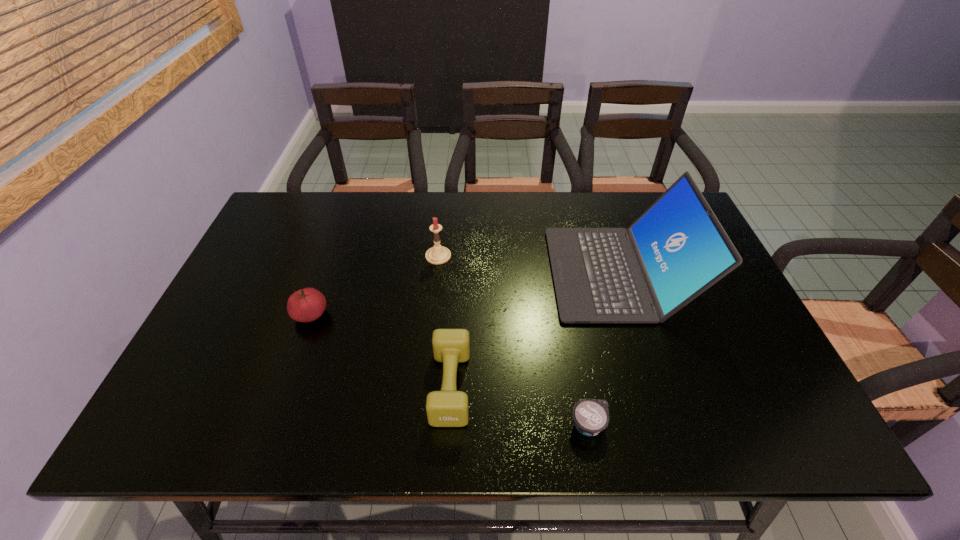
Locate an element on the screen. The width and height of the screenshot is (960, 540). vacant space located on the right of the dumbbell is located at coordinates (606, 386).

Image resolution: width=960 pixels, height=540 pixels. I want to click on free space located on the back of the yogurt, so click(x=580, y=380).

Locate an element on the screen. This screenshot has height=540, width=960. object that is at the far edge is located at coordinates (677, 249).

Locate an element on the screen. This screenshot has height=540, width=960. dumbbell that is at the near edge is located at coordinates [x=447, y=408].

Where is `yogurt located at the near edge`? This screenshot has height=540, width=960. yogurt located at the near edge is located at coordinates (591, 416).

The height and width of the screenshot is (540, 960). What are the coordinates of `object that is at the right edge` in the screenshot? It's located at (677, 249).

This screenshot has width=960, height=540. I want to click on object that is at the far right corner, so click(x=677, y=249).

Find the location of a particular element. This screenshot has height=540, width=960. vacant area at the far edge of the desktop is located at coordinates (542, 224).

This screenshot has height=540, width=960. Find the location of `vacant area at the near edge`. vacant area at the near edge is located at coordinates (629, 442).

In the image, there is a desktop. Find the location of `vacant space at the left edge`. vacant space at the left edge is located at coordinates (254, 285).